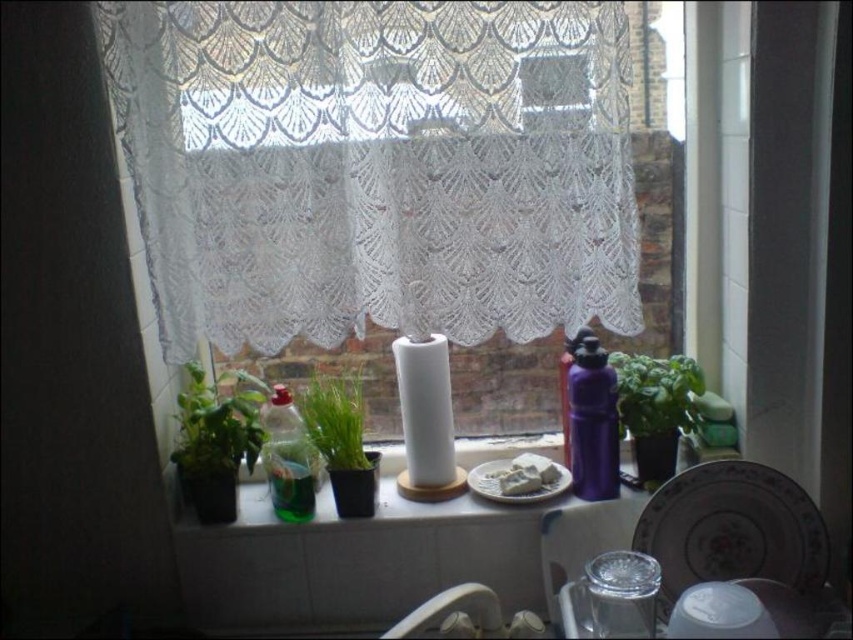
Locate an element on the screen. The image size is (853, 640). translucent green bottle at center is located at coordinates (288, 458).

Is translucent green bottle at center above white glossy sink at lower center?

Indeed, translucent green bottle at center is positioned over white glossy sink at lower center.

The image size is (853, 640). What are the coordinates of `translucent green bottle at center` in the screenshot? It's located at [288, 458].

Is green glass bottle at center below green leafy plant at left?

Indeed, green glass bottle at center is positioned under green leafy plant at left.

Does green glass bottle at center lie behind green leafy plant at left?

No, green glass bottle at center is in front of green leafy plant at left.

Identify the location of green glass bottle at center. (451, 499).

Is the position of green glass bottle at center less distant than that of green matte plant at center?

Yes, it is.

In the scene shown: Who is positioned more to the left, green glass bottle at center or green matte plant at center?

From the viewer's perspective, green matte plant at center appears more on the left side.

Is point (535, 506) closer to viewer compared to point (339, 468)?

Yes, it is in front of point (339, 468).

The width and height of the screenshot is (853, 640). I want to click on green glass bottle at center, so click(x=451, y=499).